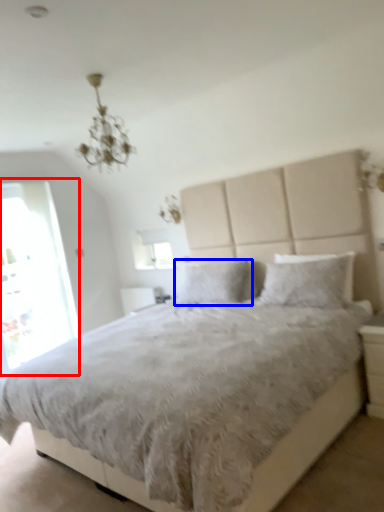
Question: Which of the following is the closest to the observer, glass door (highlighted by a red box) or pillow (highlighted by a blue box)?

Choices:
 (A) glass door
 (B) pillow

Answer: (B)